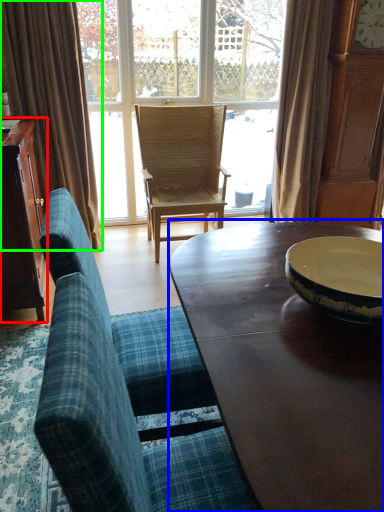
Question: Which object is the farthest from cabinetry (highlighted by a red box)? Choose among these: coffee table (highlighted by a blue box) or curtain (highlighted by a green box).

Choices:
 (A) coffee table
 (B) curtain

Answer: (A)